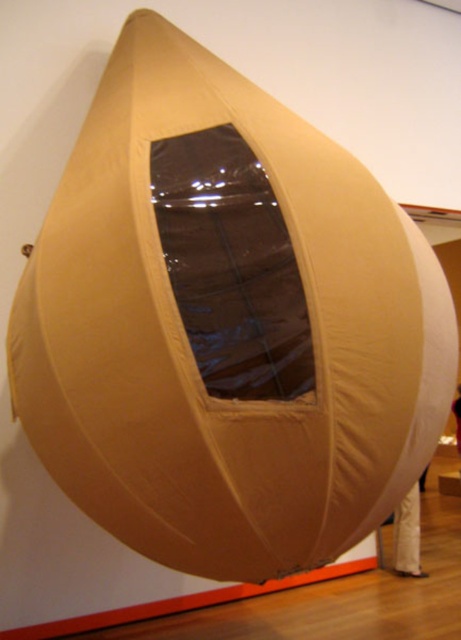
Question: Does beige fabric at lower right appear under white fabric at lower right?

Choices:
 (A) no
 (B) yes

Answer: (B)

Question: Which of the following is the farthest from the observer?

Choices:
 (A) beige fabric at lower right
 (B) white fabric at lower right

Answer: (B)

Question: Among these objects, which one is farthest from the camera?

Choices:
 (A) beige fabric at lower right
 (B) white fabric at lower right

Answer: (B)

Question: Is beige fabric at lower right bigger than white fabric at lower right?

Choices:
 (A) yes
 (B) no

Answer: (B)

Question: In this image, where is beige fabric at lower right located relative to white fabric at lower right?

Choices:
 (A) right
 (B) left

Answer: (B)

Question: Which object is closer to the camera taking this photo?

Choices:
 (A) beige fabric at lower right
 (B) white fabric at lower right

Answer: (A)